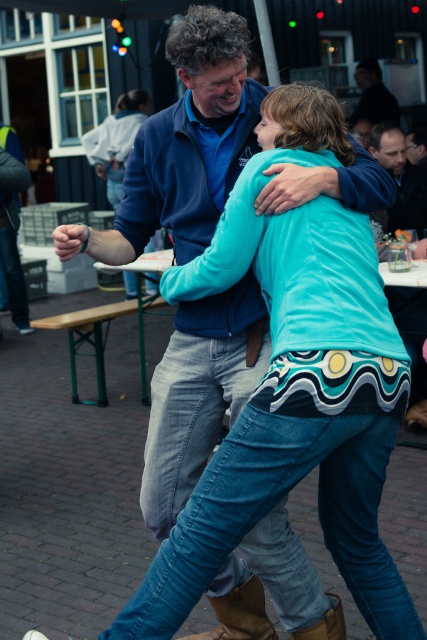
You are a photographer at the event and want to capture a photo where both the brown leather boot at lower center and the dark blue shirt at upper center are clearly visible. Is there any obstruction between them that might block the view?

The brown leather boot at lower center is in front of the dark blue shirt at upper center, so it may block part of the dark blue shirt at upper center in the photo.

You are standing in a crowded outdoor event and want to take a photo of a specific point at coordinates point (239, 627). The camera you have can only focus on objects within 10 feet. Will the camera be able to focus on that point?

The distance of point (239, 627) from camera is 10.56 feet, which is beyond the camera focus limit of 10 feet. Therefore, the camera will not be able to focus on that point.